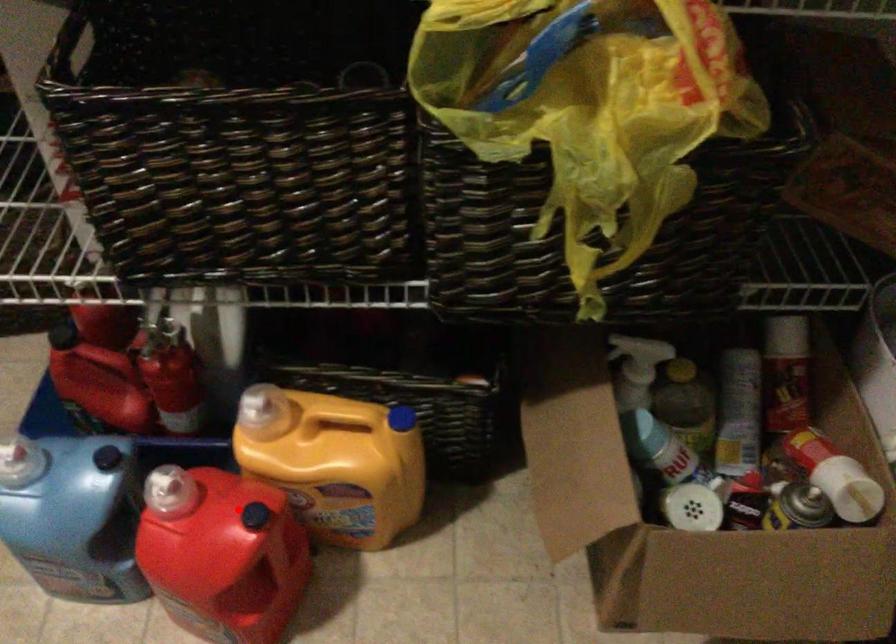
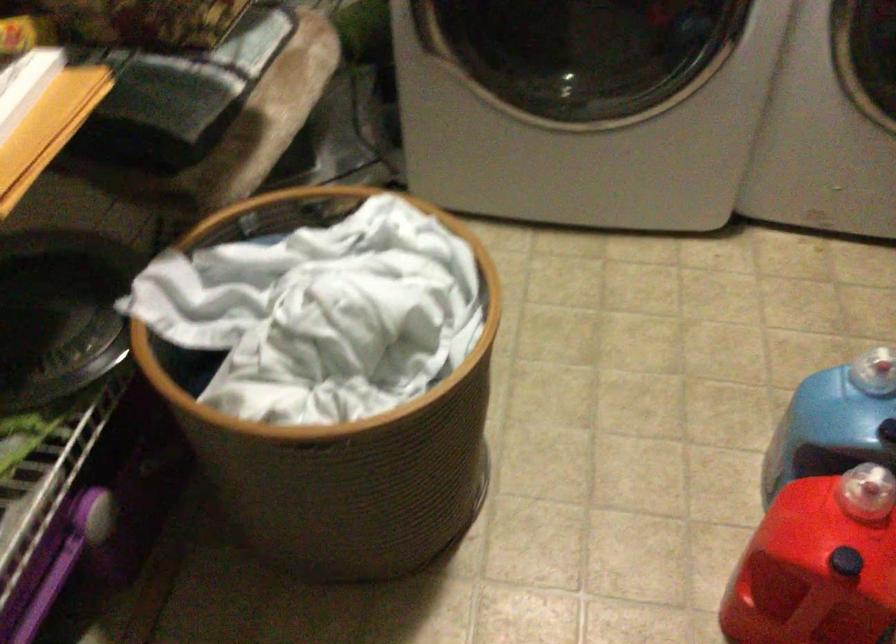
Question: A red point is marked in image1. In image2, is the corresponding 3D point closer to the camera or farther? Reply with the corresponding letter.

Choices:
 (A) The corresponding 3D point is closer.
 (B) The corresponding 3D point is farther.

Answer: (A)